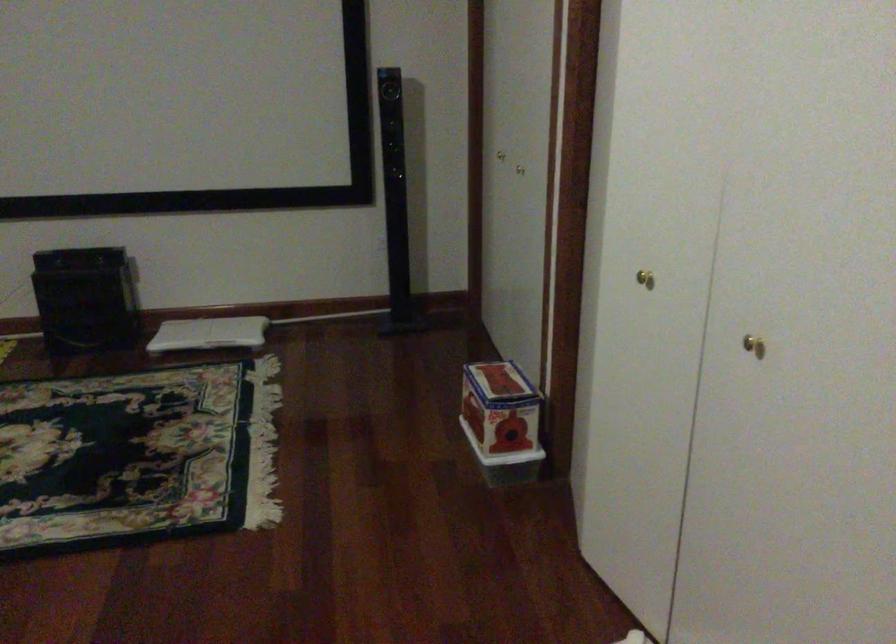
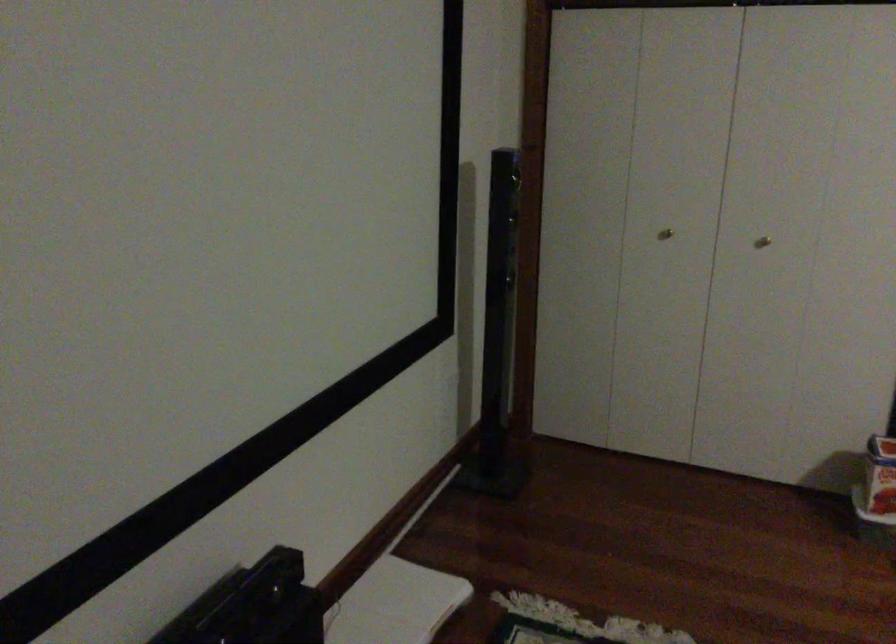
Locate, in the second image, the point that corresponds to (518,175) in the first image.

(762, 242)